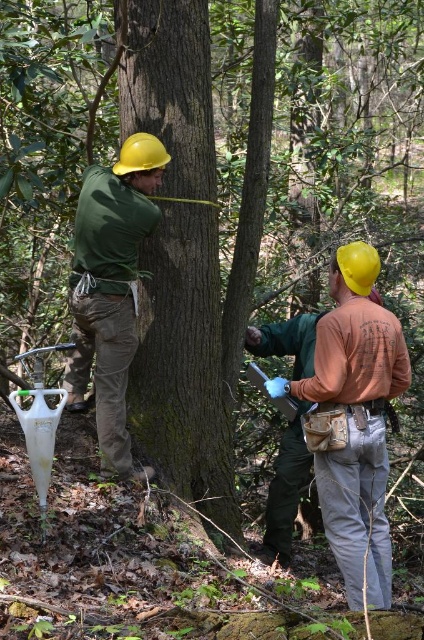
Does smooth brown tree trunk at center appear over matte green shirt at center?

Yes.

Who is more forward, (x=145, y=403) or (x=133, y=195)?

Point (x=133, y=195) is more forward.

Who is more forward, (186, 224) or (94, 332)?

Point (94, 332)

Image resolution: width=424 pixels, height=640 pixels. I want to click on smooth brown tree trunk at center, so click(184, 364).

Can you confirm if smooth brown tree trunk at center is positioned below orange fabric shirt at right?

Incorrect, smooth brown tree trunk at center is not positioned below orange fabric shirt at right.

Can you confirm if smooth brown tree trunk at center is smaller than orange fabric shirt at right?

Correct, smooth brown tree trunk at center occupies less space than orange fabric shirt at right.

Who is more forward, (175, 227) or (334, 388)?

Point (334, 388) is in front.

Where is `smooth brown tree trunk at center`? The image size is (424, 640). smooth brown tree trunk at center is located at coordinates (184, 364).

Can you confirm if orange fabric shirt at right is thinner than matte green shirt at center?

No, orange fabric shirt at right is not thinner than matte green shirt at center.

What are the coordinates of `orange fabric shirt at right` in the screenshot? It's located at click(x=354, y=420).

I want to click on orange fabric shirt at right, so click(x=354, y=420).